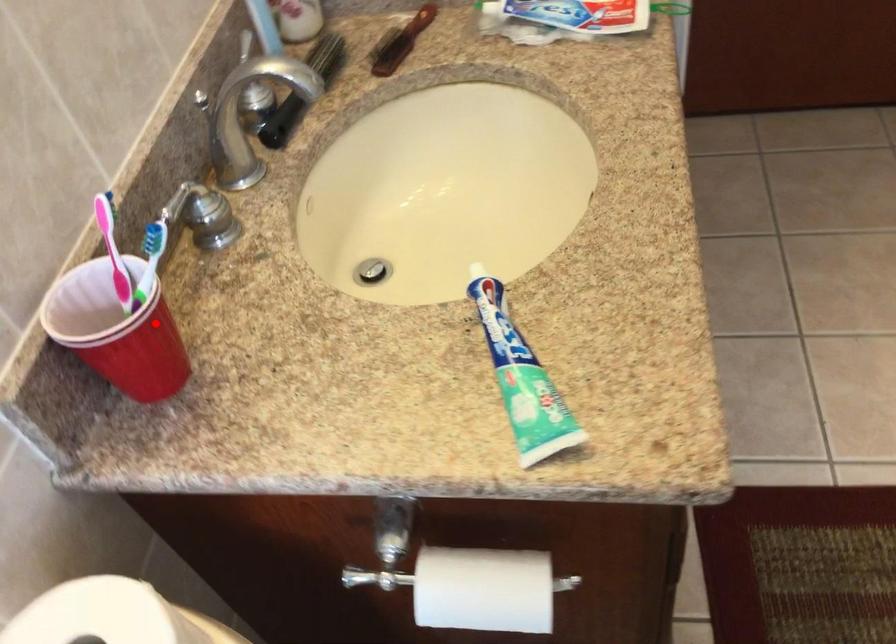
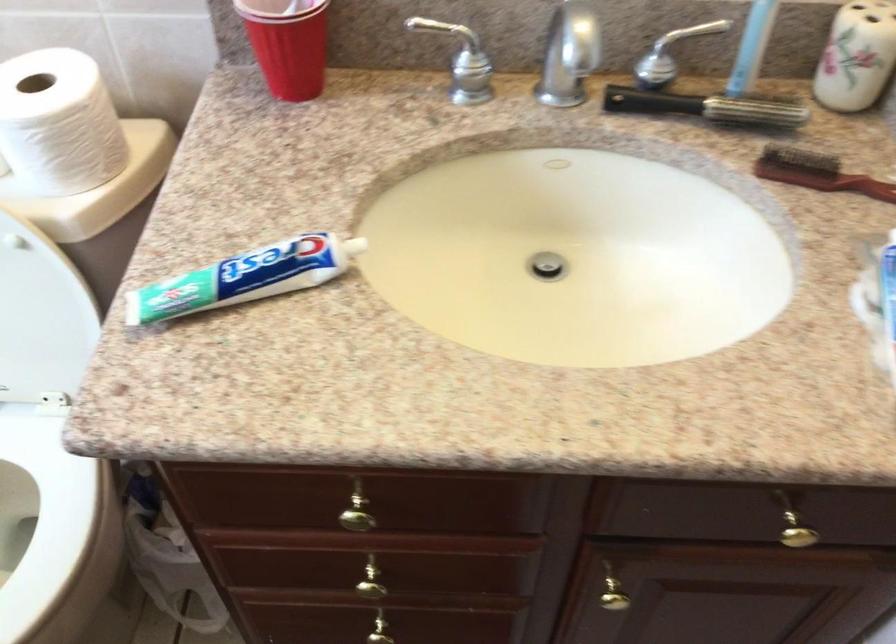
Locate, in the second image, the point that corresponds to the highlighted location in the first image.

(288, 44)